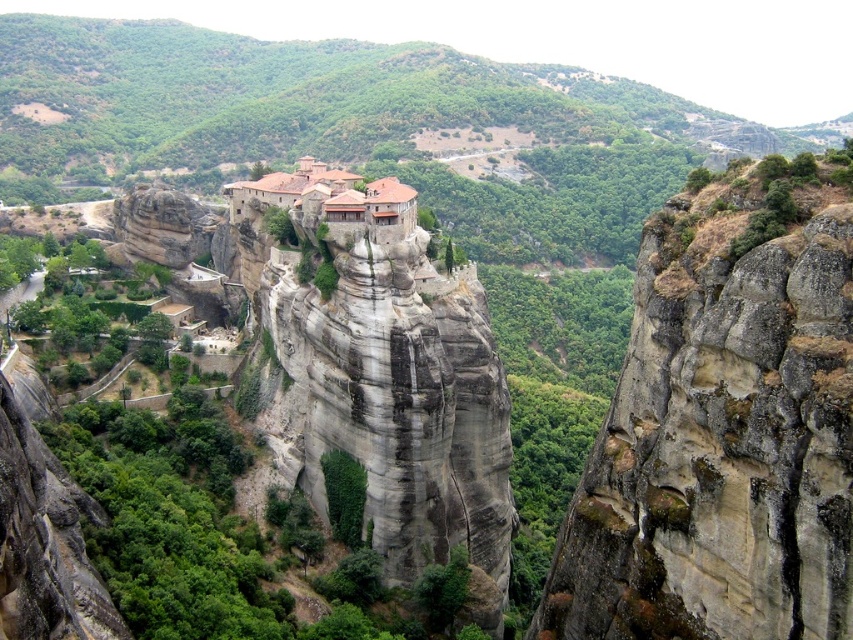
Does point (790, 305) come closer to viewer compared to point (297, 193)?

Yes, it is.

Find the location of a particular element. The width and height of the screenshot is (853, 640). gray rocky cliff at upper right is located at coordinates (724, 424).